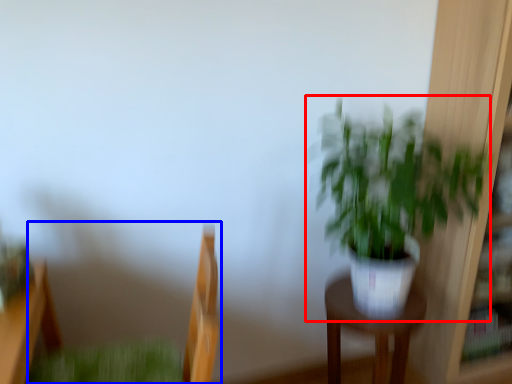
Question: Which object is closer to the camera taking this photo, houseplant (highlighted by a red box) or swivel chair (highlighted by a blue box)?

Choices:
 (A) houseplant
 (B) swivel chair

Answer: (B)